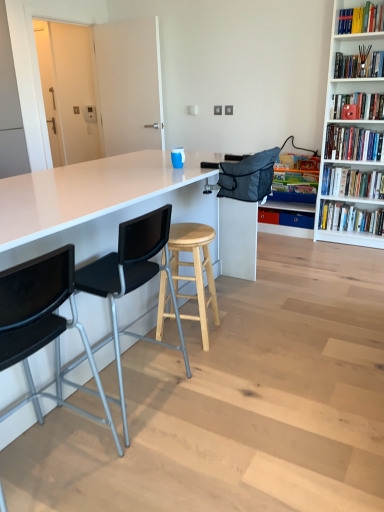
Identify the location of vacant space that's between natural wood stool at center and black plastic chair at left, the second chair positioned from the front. (162, 354).